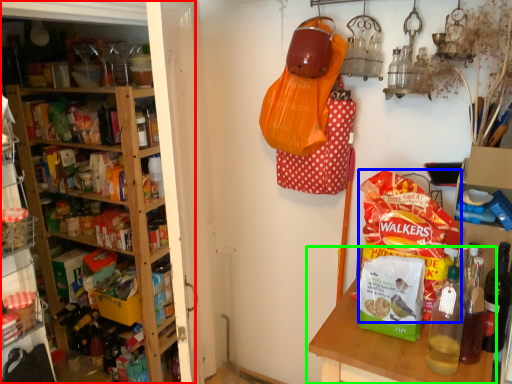
Question: Estimate the real-world distances between objects in this image. Which object is closer to shelf (highlighted by a red box), snack (highlighted by a blue box) or table (highlighted by a green box)?

Choices:
 (A) snack
 (B) table

Answer: (B)